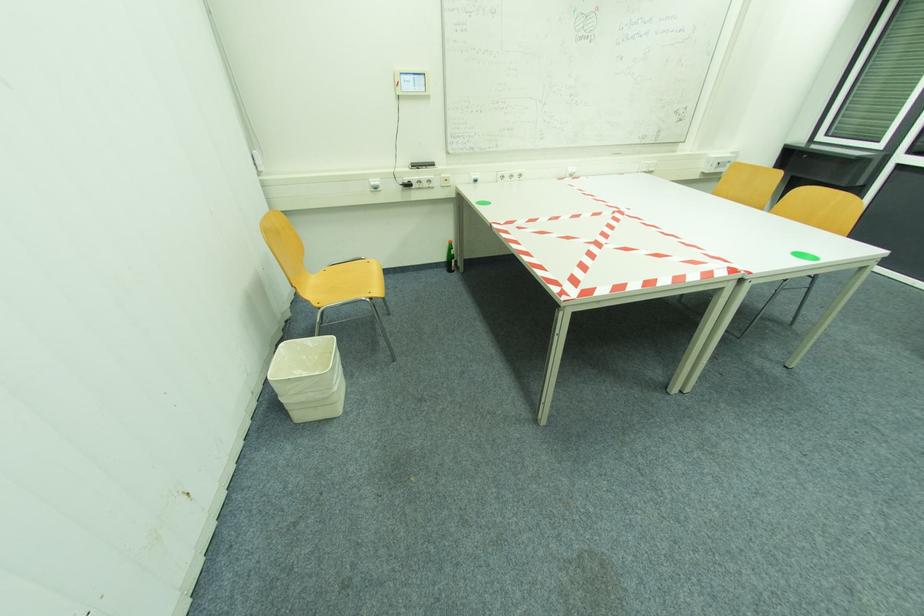
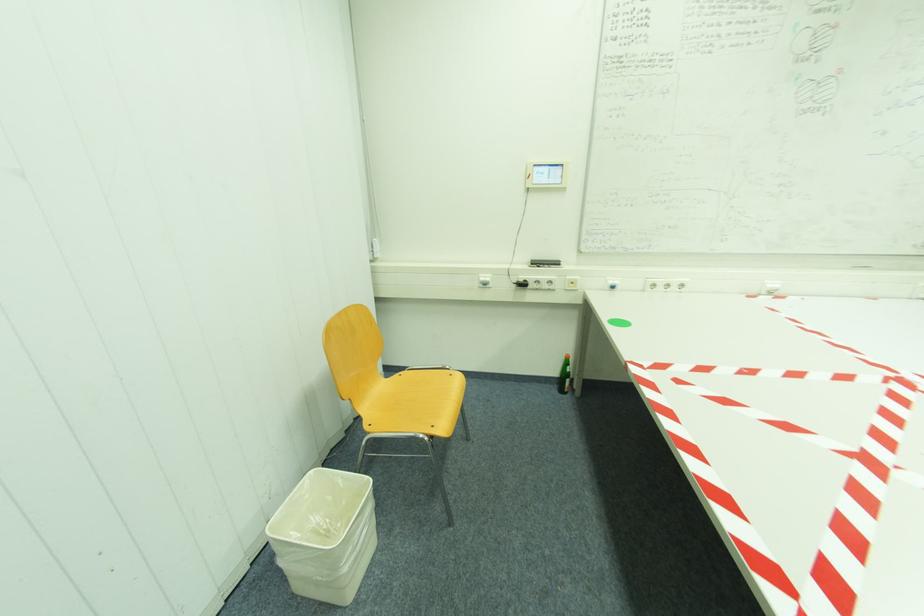
Question: The camera is either moving clockwise (left) or counter-clockwise (right) around the object. The first image is from the beginning of the video and the second image is from the end. Is the camera moving left or right when shooting the video?

Choices:
 (A) Left
 (B) Right

Answer: (B)